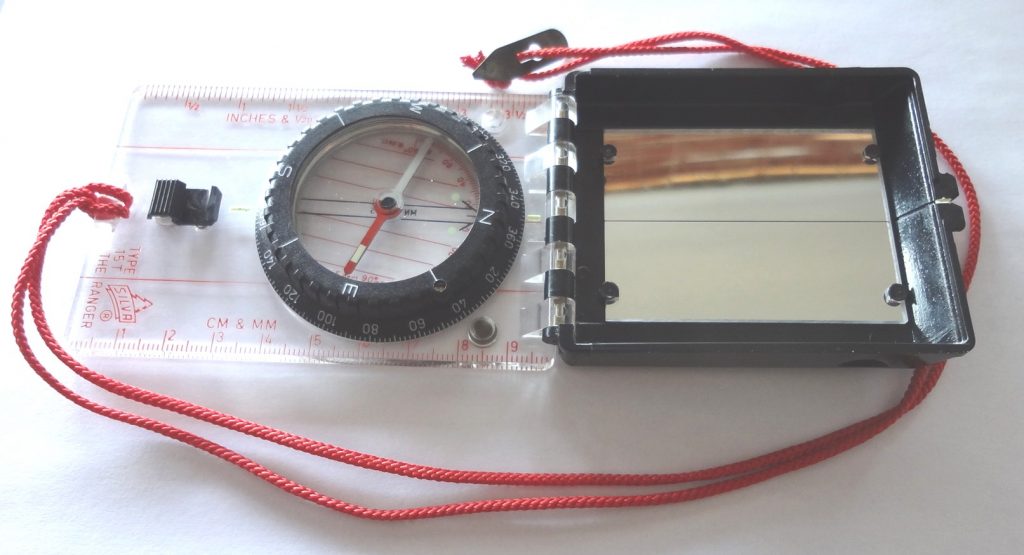
Identify the location of frame. (715, 332).